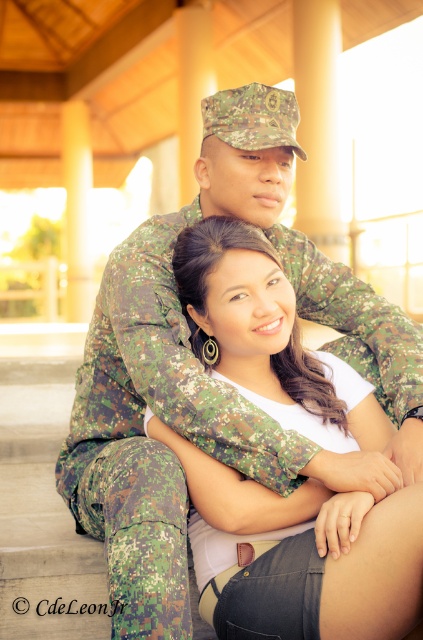
Does matte camouflage shirt at center have a lesser height compared to camouflage fabric uniform at center?

In fact, matte camouflage shirt at center may be taller than camouflage fabric uniform at center.

Is point (252, 577) closer to camera compared to point (253, 401)?

That is True.

Which is behind, point (220, 628) or point (315, 417)?

The point (315, 417) is more distant.

You are a GUI agent. You are given a task and a screenshot of the screen. Output one action in this format:
    pyautogui.click(x=<x>, y=<y>)
    Task: Click on the matte camouflage shirt at center
    This screenshot has height=640, width=423.
    Given the screenshot: What is the action you would take?
    pyautogui.click(x=266, y=337)